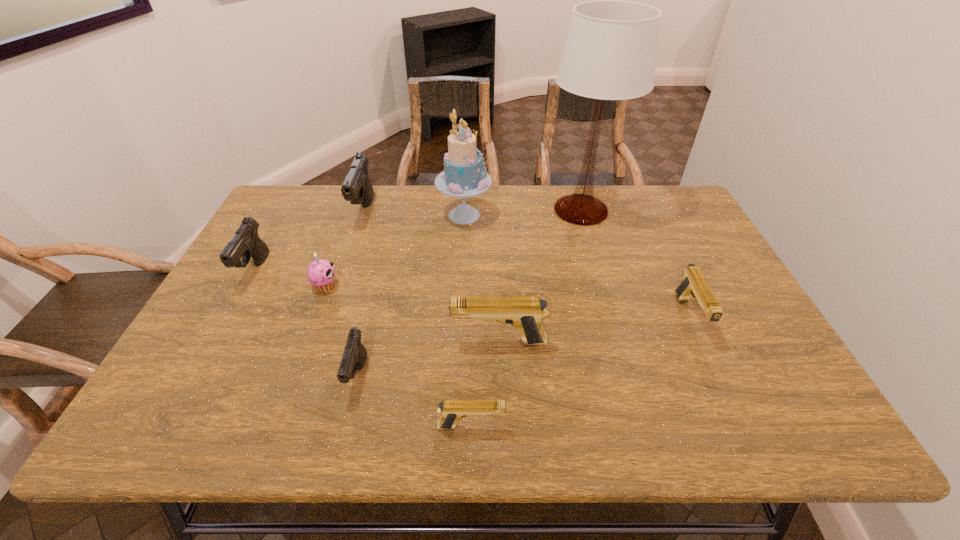
Find the location of a particular element. Image resolution: width=960 pixels, height=540 pixels. vacant area that lies between the rightmost pistol and the table lamp is located at coordinates (635, 264).

Where is `free space between the second smallest tan pistol and the cake`? This screenshot has height=540, width=960. free space between the second smallest tan pistol and the cake is located at coordinates (577, 266).

Identify the location of unoccupied area between the cupcake and the nearest pistol. This screenshot has height=540, width=960. (398, 356).

Locate an element on the screen. free space between the biggest tan pistol and the second biggest black pistol is located at coordinates (377, 306).

At what (x,y) coordinates should I click in order to perform the action: click on empty space between the biggest tan pistol and the rightmost pistol. Please return your answer as a coordinate pair (x, y). Looking at the image, I should click on (594, 329).

At what (x,y) coordinates should I click in order to perform the action: click on object that is the fourth closest to the second smallest black pistol. Please return your answer as a coordinate pair (x, y). Looking at the image, I should click on (464, 175).

Locate which object ranks in proximity to the tallest object. Please provide its 2D coordinates. Your answer should be formatted as a tuple, i.e. [(x, y)], where the tuple contains the x and y coordinates of a point satisfying the conditions above.

[(464, 175)]

Where is `the fifth closest pistol to the biggest tan pistol`? the fifth closest pistol to the biggest tan pistol is located at coordinates (246, 243).

Identify which pistol is the nearest to the cupcake. Please provide its 2D coordinates. Your answer should be formatted as a tuple, i.e. [(x, y)], where the tuple contains the x and y coordinates of a point satisfying the conditions above.

[(246, 243)]

Locate an element on the screen. the second closest black pistol relative to the table lamp is located at coordinates (354, 356).